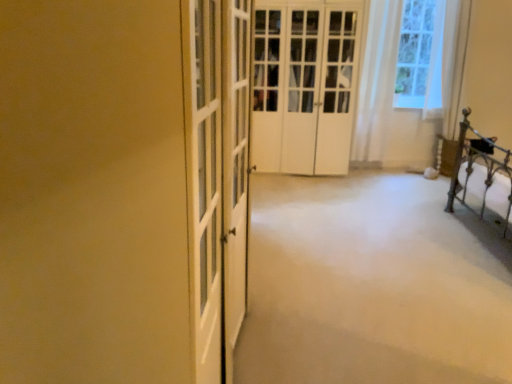
What do you see at coordinates (376, 84) in the screenshot? The width and height of the screenshot is (512, 384). I see `white sheer curtain at upper right` at bounding box center [376, 84].

Find the location of `white matte door at center`. white matte door at center is located at coordinates (304, 85).

Identify the location of white sheer curtain at upper right. The image size is (512, 384). (376, 84).

Is white sheer curtain at upper right positioned with its back to white carpet at center?

No.

Who is taller, white sheer curtain at upper right or white carpet at center?

white sheer curtain at upper right.

Considering the relative sizes of white sheer curtain at upper right and white carpet at center in the image provided, is white sheer curtain at upper right bigger than white carpet at center?

No, white sheer curtain at upper right is not bigger than white carpet at center.

From a real-world perspective, does white sheer curtain at upper right sit lower than white carpet at center?

No, from a real-world perspective, white sheer curtain at upper right is not beneath white carpet at center.

Image resolution: width=512 pixels, height=384 pixels. Identify the location of curtain behind the white carpet at center. (376, 84).

From the image's perspective, is white carpet at center positioned above or below white sheer curtain at upper right?

white carpet at center is situated lower than white sheer curtain at upper right in the image.

From the picture: Could you tell me if white carpet at center is turned towards white sheer curtain at upper right?

No, white carpet at center is not turned towards white sheer curtain at upper right.

Based on the photo, in the image, is white carpet at center positioned in front of or behind white sheer curtain at upper right?

white carpet at center is in front of white sheer curtain at upper right.

Considering the sizes of objects white matte door at center and white carpet at center in the image provided, who is thinner, white matte door at center or white carpet at center?

white matte door at center.

Is white carpet at center at the back of white matte door at center?

No, white matte door at center is not facing the opposite direction of white carpet at center.

Is white matte door at center bigger or smaller than white carpet at center?

Clearly, white matte door at center is larger in size than white carpet at center.

Which object is positioned more to the right, white matte door at center or white carpet at center?

white carpet at center.

From a real-world perspective, relative to white matte door at center, is white sheer curtain at upper right vertically above or below?

From a real-world perspective, white sheer curtain at upper right is physically above white matte door at center.

Is white sheer curtain at upper right to the left or to the right of white matte door at center in the image?

Clearly, white sheer curtain at upper right is on the right of white matte door at center in the image.

Is white sheer curtain at upper right spatially inside white matte door at center, or outside of it?

white sheer curtain at upper right cannot be found inside white matte door at center.

Considering the sizes of white sheer curtain at upper right and white matte door at center in the image, is white sheer curtain at upper right taller or shorter than white matte door at center?

Considering their sizes, white sheer curtain at upper right has less height than white matte door at center.

Would you say white carpet at center is outside white matte door at center?

white carpet at center is positioned outside white matte door at center.

Is white carpet at center facing away from white matte door at center?

white carpet at center does not have its back to white matte door at center.

Considering the positions of objects white carpet at center and white matte door at center in the image provided, who is more to the right, white carpet at center or white matte door at center?

white carpet at center is more to the right.

Which is farther, (261, 278) or (280, 46)?

Point (280, 46)

Identify the location of door that is below the white sheer curtain at upper right (from the image's perspective). This screenshot has width=512, height=384. coord(304,85).

From the image's perspective, which one is positioned higher, white matte door at center or white sheer curtain at upper right?

white sheer curtain at upper right appears higher in the image.

Is white matte door at center wider than white sheer curtain at upper right?

Indeed, white matte door at center has a greater width compared to white sheer curtain at upper right.

Locate an element on the screen. The image size is (512, 384). curtain above the white carpet at center (from the image's perspective) is located at coordinates (376, 84).

Identify the location of curtain above the white carpet at center (from a real-world perspective). (376, 84).

Which object lies further to the anchor point white carpet at center, white matte door at center or white sheer curtain at upper right?

white sheer curtain at upper right is further to white carpet at center.

Considering their positions, is white carpet at center positioned closer to white sheer curtain at upper right than white matte door at center?

white matte door at center is positioned closer to the anchor white sheer curtain at upper right.

Which object lies further to the anchor point white matte door at center, white carpet at center or white sheer curtain at upper right?

white carpet at center lies further to white matte door at center than the other object.

Which object lies nearer to the anchor point white sheer curtain at upper right, white matte door at center or white carpet at center?

Among the two, white matte door at center is located nearer to white sheer curtain at upper right.

When comparing their distances from white carpet at center, does white sheer curtain at upper right or white matte door at center seem further?

Based on the image, white sheer curtain at upper right appears to be further to white carpet at center.

Considering their positions, is white sheer curtain at upper right positioned further to white matte door at center than white carpet at center?

white carpet at center is further to white matte door at center.

You are a GUI agent. You are given a task and a screenshot of the screen. Output one action in this format:
    pyautogui.click(x=<x>, y=<y>)
    Task: Click on the door positioned between white carpet at center and white sheer curtain at upper right from near to far
    This screenshot has height=384, width=512.
    Given the screenshot: What is the action you would take?
    pyautogui.click(x=304, y=85)